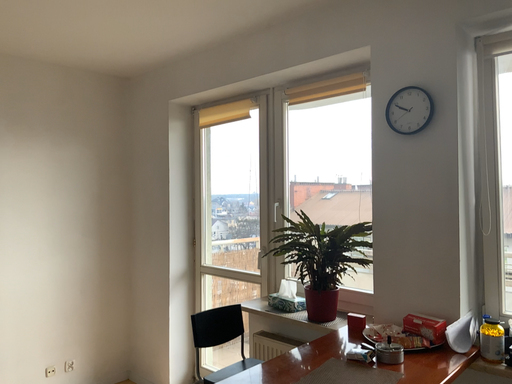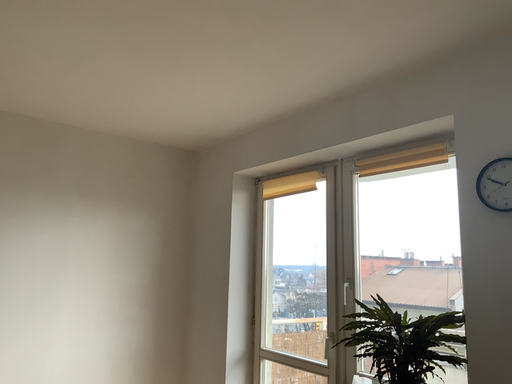
Question: Which way did the camera rotate in the video?

Choices:
 (A) rotated left
 (B) rotated right

Answer: (A)